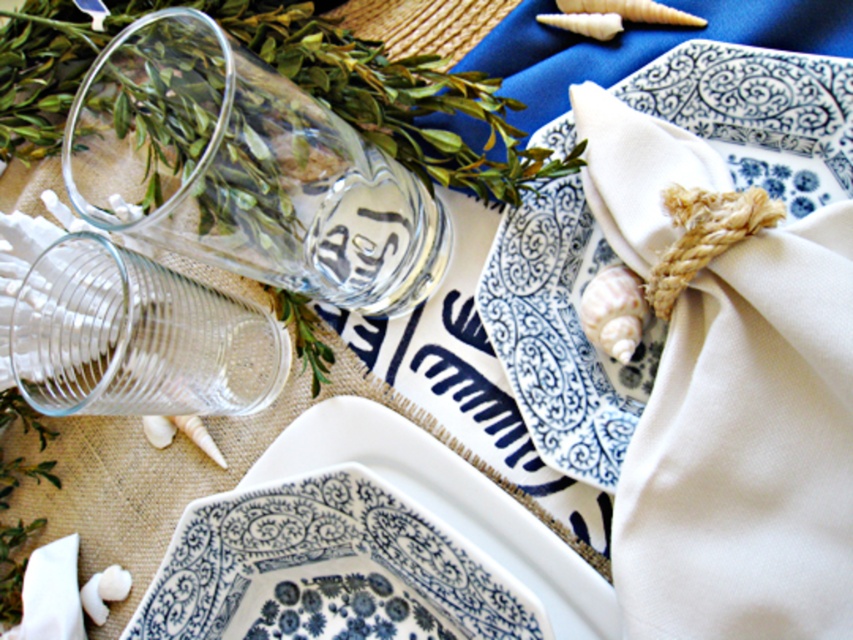
You are a guest at a coastal themed dinner and want to place your napkin on the correct plate. The blue and white ceramic plate at upper right is located at point (561, 333). Where should you place your napkin?

The blue and white ceramic plate at upper right is located at point (561, 333), so you should place your napkin there.

You are a server at a coastal themed restaurant and need to stack the blue and white ceramic plate at upper right and the blue and white ceramic platter at center for storage. Which one should you place on top to prevent breakage?

The blue and white ceramic plate at upper right is much taller than the blue and white ceramic platter at center, so placing the plate on top would be safer to prevent breakage since taller items are generally more stable when stacked.

Based on the photo, you are setting up a table for a coastal themed event. You have a blue and white ceramic plate at upper right and a blue and white ceramic platter at center. Which one is positioned higher on the table?

The blue and white ceramic plate at upper right is positioned higher on the table because it is above the blue and white ceramic platter at center.